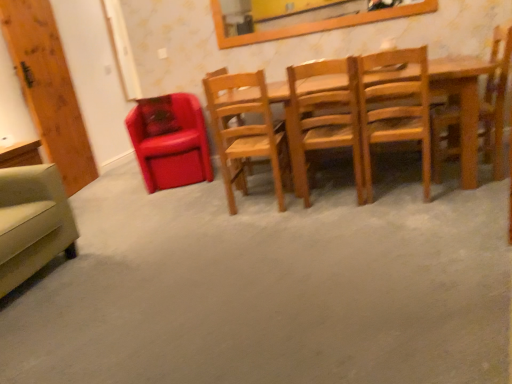
Question: In the image, is wooden frame at upper center positioned in front of or behind wooden chair at center, arranged as the third chair when viewed from the left?

Choices:
 (A) front
 (B) behind

Answer: (B)

Question: In terms of height, does wooden frame at upper center look taller or shorter compared to wooden chair at center, marked as the fourth chair in a right-to-left arrangement?

Choices:
 (A) tall
 (B) short

Answer: (B)

Question: Estimate the real-world distances between objects in this image. Which object is closer to the wooden chair at right, the sixth chair positioned from the left?

Choices:
 (A) wooden frame at upper center
 (B) wooden chair at center, arranged as the third chair when viewed from the left
 (C) wooden chair at center, the fifth chair viewed from the left
 (D) wooden chair at center, which is the fourth chair from left to right
 (E) matte leather chair at left, marked as the second chair in a left-to-right arrangement

Answer: (C)

Question: Estimate the real-world distances between objects in this image. Which object is closer to the wooden chair at center, marked as the fourth chair in a right-to-left arrangement?

Choices:
 (A) wooden chair at center, which is the fourth chair from left to right
 (B) beige fabric armchair at lower left, the 1th chair positioned from the left
 (C) matte leather chair at left, marked as the second chair in a left-to-right arrangement
 (D) wooden frame at upper center
 (E) wooden chair at right, the sixth chair positioned from the left

Answer: (A)